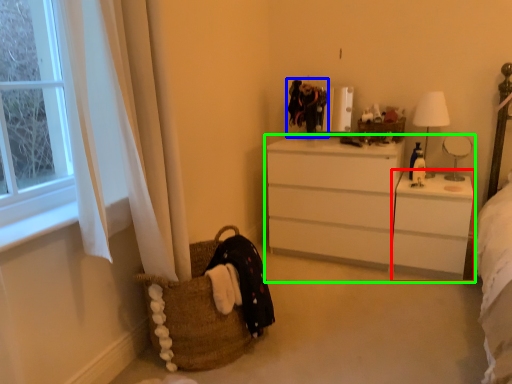
Question: Estimate the real-world distances between objects in this image. Which object is farther from changing table (highlighted by a red box), clothing (highlighted by a blue box) or chest of drawers (highlighted by a green box)?

Choices:
 (A) clothing
 (B) chest of drawers

Answer: (A)